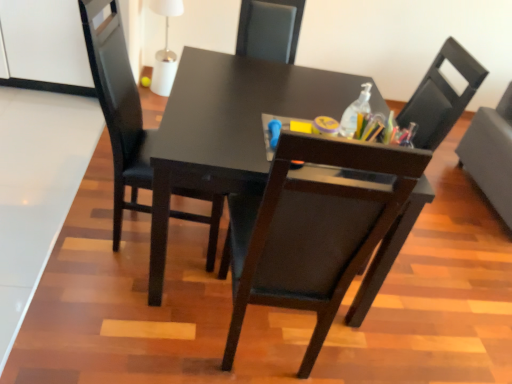
Locate an element on the screen. The image size is (512, 384). matte black chair at center, the second chair from the left is located at coordinates (441, 97).

The image size is (512, 384). Describe the element at coordinates (355, 112) in the screenshot. I see `clear plastic bottle at upper right` at that location.

You are a GUI agent. You are given a task and a screenshot of the screen. Output one action in this format:
    pyautogui.click(x=<x>, y=<y>)
    Task: Click on the matte black chair at center, marked as the 2th chair in a right-to-left arrangement
    The width and height of the screenshot is (512, 384).
    Given the screenshot: What is the action you would take?
    pyautogui.click(x=441, y=97)

How many degrees apart are the facing directions of matte black chair at center, the first chair in the left-to-right sequence, and matte black chair at center, marked as the 2th chair in a right-to-left arrangement?

They differ by 82.1 degrees in their facing directions.

Is matte black chair at center, the first chair in the left-to-right sequence, not close to matte black chair at center, marked as the 2th chair in a right-to-left arrangement?

Yes, matte black chair at center, the first chair in the left-to-right sequence, is far from matte black chair at center, marked as the 2th chair in a right-to-left arrangement.

Between matte black chair at center, which ranks as the third chair in right-to-left order, and matte black chair at center, the second chair from the left, which one is positioned behind?

matte black chair at center, which ranks as the third chair in right-to-left order, is further away from the camera.

Considering the sizes of objects matte black chair at center, the first chair in the left-to-right sequence, and matte black chair at center, marked as the 2th chair in a right-to-left arrangement, in the image provided, who is shorter, matte black chair at center, the first chair in the left-to-right sequence, or matte black chair at center, marked as the 2th chair in a right-to-left arrangement,?

matte black chair at center, the first chair in the left-to-right sequence, is shorter.

Which object is closer to the camera, black matte chair at right, acting as the 3th chair starting from the left, or matte black chair at center, the first chair in the left-to-right sequence?

matte black chair at center, the first chair in the left-to-right sequence.

In the scene shown: Is matte black chair at center, the first chair in the left-to-right sequence, at the back of black matte chair at right, acting as the 3th chair starting from the left?

No, black matte chair at right, acting as the 3th chair starting from the left, is not facing away from matte black chair at center, the first chair in the left-to-right sequence.

Is clear plastic bottle at upper right placed right next to matte black chair at center, marked as the 2th chair in a right-to-left arrangement?

clear plastic bottle at upper right and matte black chair at center, marked as the 2th chair in a right-to-left arrangement, are not in contact.

Which is behind, point (368, 111) or point (446, 134)?

Positioned behind is point (446, 134).

Consider the image. Is the position of clear plastic bottle at upper right more distant than that of matte black chair at center, the second chair from the left?

Yes.

In the scene shown: From a real-world perspective, is clear plastic bottle at upper right over matte black chair at center, the second chair from the left?

Yes.

Is clear plastic bottle at upper right inside matte black chair at center, marked as the 2th chair in a right-to-left arrangement?

No, clear plastic bottle at upper right is not a part of matte black chair at center, marked as the 2th chair in a right-to-left arrangement.

From the image's perspective, is matte black chair at center, the second chair from the left, above or below clear plastic bottle at upper right?

matte black chair at center, the second chair from the left, is situated lower than clear plastic bottle at upper right in the image.

Considering the positions of objects matte black chair at center, the second chair from the left, and clear plastic bottle at upper right in the image provided, who is behind, matte black chair at center, the second chair from the left, or clear plastic bottle at upper right?

clear plastic bottle at upper right is behind.

Can you confirm if matte black chair at center, the second chair from the left, is bigger than clear plastic bottle at upper right?

Correct, matte black chair at center, the second chair from the left, is larger in size than clear plastic bottle at upper right.

From the image's perspective, is black matte chair at right, the 1th chair when ordered from right to left, located above clear plastic bottle at upper right?

No, from the image's perspective, black matte chair at right, the 1th chair when ordered from right to left, is not on top of clear plastic bottle at upper right.

Does black matte chair at right, acting as the 3th chair starting from the left, have a larger size compared to clear plastic bottle at upper right?

Yes, black matte chair at right, acting as the 3th chair starting from the left, is bigger than clear plastic bottle at upper right.

Can you confirm if black matte chair at right, the 1th chair when ordered from right to left, is wider than clear plastic bottle at upper right?

Yes.

Looking at this image, are black matte chair at right, acting as the 3th chair starting from the left, and clear plastic bottle at upper right making contact?

There is a gap between black matte chair at right, acting as the 3th chair starting from the left, and clear plastic bottle at upper right.

Considering the points (227, 257) and (132, 85), which point is behind, point (227, 257) or point (132, 85)?

The point (227, 257) is more distant.

Between matte black chair at center, marked as the 2th chair in a right-to-left arrangement, and matte black chair at center, the first chair in the left-to-right sequence, which one has smaller width?

matte black chair at center, the first chair in the left-to-right sequence, is thinner.

Looking at this image, from the image's perspective, is matte black chair at center, marked as the 2th chair in a right-to-left arrangement, located above or below matte black chair at center, which ranks as the third chair in right-to-left order?

matte black chair at center, marked as the 2th chair in a right-to-left arrangement, is situated lower than matte black chair at center, which ranks as the third chair in right-to-left order, in the image.

Does matte black chair at center, the first chair in the left-to-right sequence, have a greater width compared to black matte chair at right, acting as the 3th chair starting from the left?

Incorrect, the width of matte black chair at center, the first chair in the left-to-right sequence, does not surpass that of black matte chair at right, acting as the 3th chair starting from the left.

Looking at this image, could you measure the distance between matte black chair at center, which ranks as the third chair in right-to-left order, and black matte chair at right, the 1th chair when ordered from right to left?

matte black chair at center, which ranks as the third chair in right-to-left order, is 2.02 meters away from black matte chair at right, the 1th chair when ordered from right to left.

Can you confirm if matte black chair at center, which ranks as the third chair in right-to-left order, is taller than black matte chair at right, acting as the 3th chair starting from the left?

Correct, matte black chair at center, which ranks as the third chair in right-to-left order, is much taller as black matte chair at right, acting as the 3th chair starting from the left.

Is point (120, 97) positioned before point (511, 113)?

Yes, point (120, 97) is in front of point (511, 113).

From the image's perspective, count 1st chairs upward from the matte black chair at center, marked as the 2th chair in a right-to-left arrangement, and point to it. Please provide its 2D coordinates.

[(118, 107)]

The width and height of the screenshot is (512, 384). There is a matte black chair at center, the first chair in the left-to-right sequence. In order to click on the 2nd chair below it (from a real-world perspective) in this screenshot , I will do `click(490, 154)`.

From the picture: When comparing their distances from matte black chair at center, the first chair in the left-to-right sequence, does clear plastic bottle at upper right or black matte chair at right, the 1th chair when ordered from right to left, seem closer?

Among the two, clear plastic bottle at upper right is located nearer to matte black chair at center, the first chair in the left-to-right sequence.

When comparing their distances from matte black chair at center, marked as the 2th chair in a right-to-left arrangement, does clear plastic bottle at upper right or black matte chair at right, acting as the 3th chair starting from the left, seem closer?

Based on the image, clear plastic bottle at upper right appears to be nearer to matte black chair at center, marked as the 2th chair in a right-to-left arrangement.

Which object lies further to the anchor point black matte chair at right, the 1th chair when ordered from right to left, matte black chair at center, which ranks as the third chair in right-to-left order, or matte black chair at center, the second chair from the left?

matte black chair at center, which ranks as the third chair in right-to-left order, is positioned further to the anchor black matte chair at right, the 1th chair when ordered from right to left.

Based on their spatial positions, is clear plastic bottle at upper right or matte black chair at center, the first chair in the left-to-right sequence, further from black matte chair at right, the 1th chair when ordered from right to left?

matte black chair at center, the first chair in the left-to-right sequence.

Based on their spatial positions, is black matte chair at right, the 1th chair when ordered from right to left, or matte black chair at center, the first chair in the left-to-right sequence, closer to matte black chair at center, the second chair from the left?

matte black chair at center, the first chair in the left-to-right sequence, is closer to matte black chair at center, the second chair from the left.

In the scene shown: From the image, which object appears to be farther from matte black chair at center, the second chair from the left, matte black chair at center, the first chair in the left-to-right sequence, or black matte chair at right, acting as the 3th chair starting from the left?

black matte chair at right, acting as the 3th chair starting from the left, is further to matte black chair at center, the second chair from the left.

Based on their spatial positions, is matte black chair at center, marked as the 2th chair in a right-to-left arrangement, or clear plastic bottle at upper right closer to black matte chair at right, acting as the 3th chair starting from the left?

Based on the image, matte black chair at center, marked as the 2th chair in a right-to-left arrangement, appears to be nearer to black matte chair at right, acting as the 3th chair starting from the left.

In the scene shown: Which object lies nearer to the anchor point matte black chair at center, the first chair in the left-to-right sequence, black matte chair at right, the 1th chair when ordered from right to left, or matte black chair at center, marked as the 2th chair in a right-to-left arrangement?

Based on the image, matte black chair at center, marked as the 2th chair in a right-to-left arrangement, appears to be nearer to matte black chair at center, the first chair in the left-to-right sequence.

Where is `chair between matte black chair at center, the first chair in the left-to-right sequence, and clear plastic bottle at upper right`? chair between matte black chair at center, the first chair in the left-to-right sequence, and clear plastic bottle at upper right is located at coordinates (441, 97).

The width and height of the screenshot is (512, 384). What are the coordinates of `bottle situated between matte black chair at center, the first chair in the left-to-right sequence, and black matte chair at right, acting as the 3th chair starting from the left, from left to right` in the screenshot? It's located at (355, 112).

What are the coordinates of `bottle situated between matte black chair at center, marked as the 2th chair in a right-to-left arrangement, and black matte chair at right, the 1th chair when ordered from right to left, from left to right` in the screenshot? It's located at (355, 112).

This screenshot has height=384, width=512. What are the coordinates of `chair between matte black chair at center, which ranks as the third chair in right-to-left order, and black matte chair at right, acting as the 3th chair starting from the left, from left to right` in the screenshot? It's located at (441, 97).